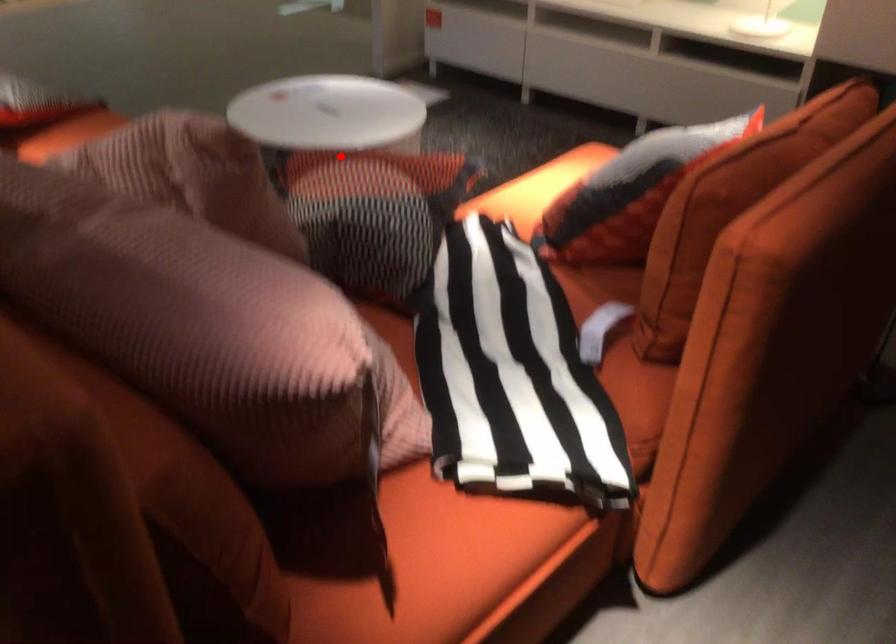
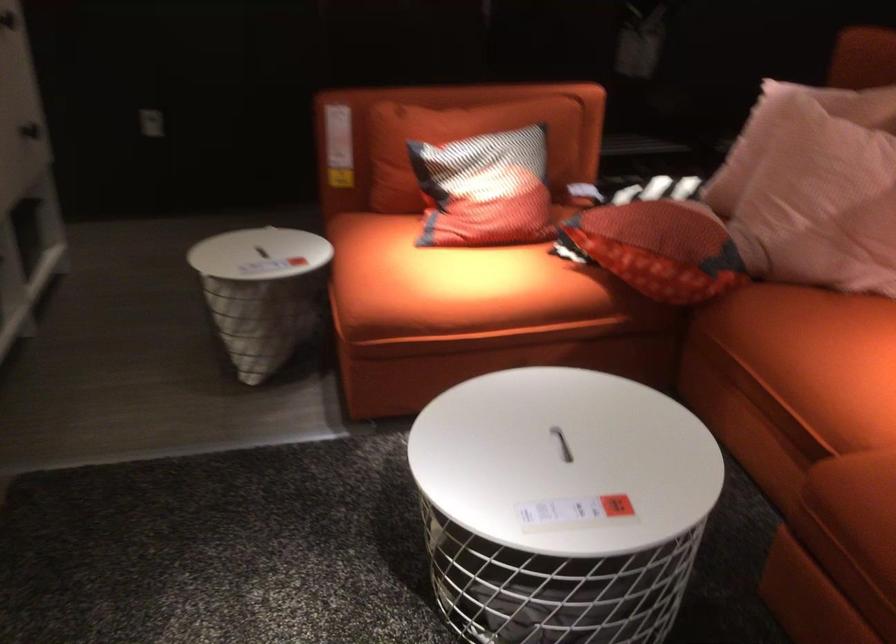
Find the pixel in the second image that matches the highlighted location in the first image.

(659, 248)